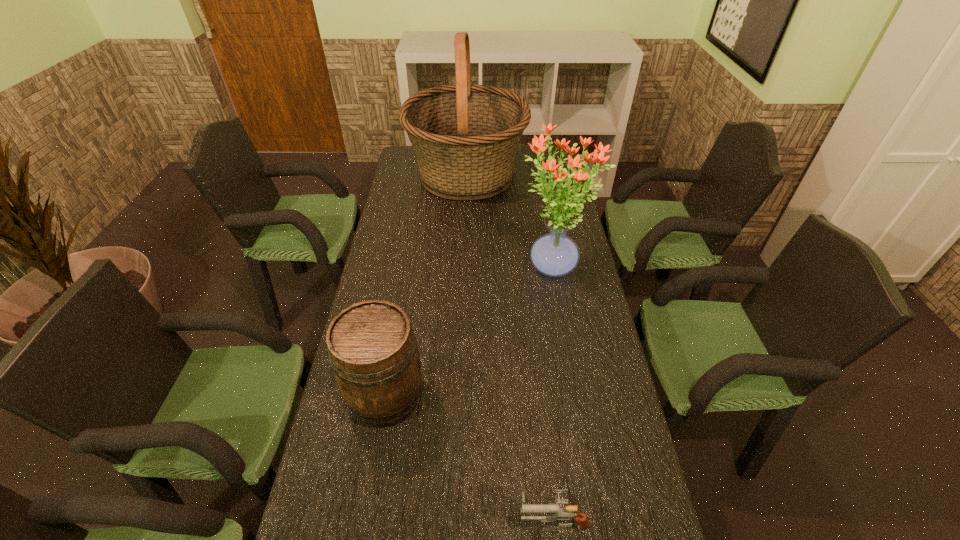
The height and width of the screenshot is (540, 960). Find the location of `cider present at the left edge`. cider present at the left edge is located at coordinates (372, 349).

This screenshot has width=960, height=540. I want to click on object that is at the right edge, so click(x=555, y=254).

Identify the location of object present at the far left corner. The width and height of the screenshot is (960, 540). (465, 136).

The width and height of the screenshot is (960, 540). Find the location of `vacant space at the left edge`. vacant space at the left edge is located at coordinates (380, 232).

The image size is (960, 540). In the image, there is a desktop. In order to click on vacant space at the right edge in this screenshot , I will do `click(600, 505)`.

Identify the location of vacant space at the far left corner of the desktop. This screenshot has height=540, width=960. (403, 166).

Where is `vacant area that lies between the third farthest object and the third shortest object`? This screenshot has width=960, height=540. vacant area that lies between the third farthest object and the third shortest object is located at coordinates (468, 333).

You are a GUI agent. You are given a task and a screenshot of the screen. Output one action in this format:
    pyautogui.click(x=<x>, y=<y>)
    Task: Click on the free space between the second nearest object and the flower arrangement
    Image resolution: width=960 pixels, height=540 pixels.
    Given the screenshot: What is the action you would take?
    pyautogui.click(x=468, y=333)

Identify which object is the third nearest to the farthest object. Please provide its 2D coordinates. Your answer should be formatted as a tuple, i.e. [(x, y)], where the tuple contains the x and y coordinates of a point satisfying the conditions above.

[(581, 519)]

Choose which object is the third nearest neighbor to the nearest object. Please provide its 2D coordinates. Your answer should be formatted as a tuple, i.e. [(x, y)], where the tuple contains the x and y coordinates of a point satisfying the conditions above.

[(465, 136)]